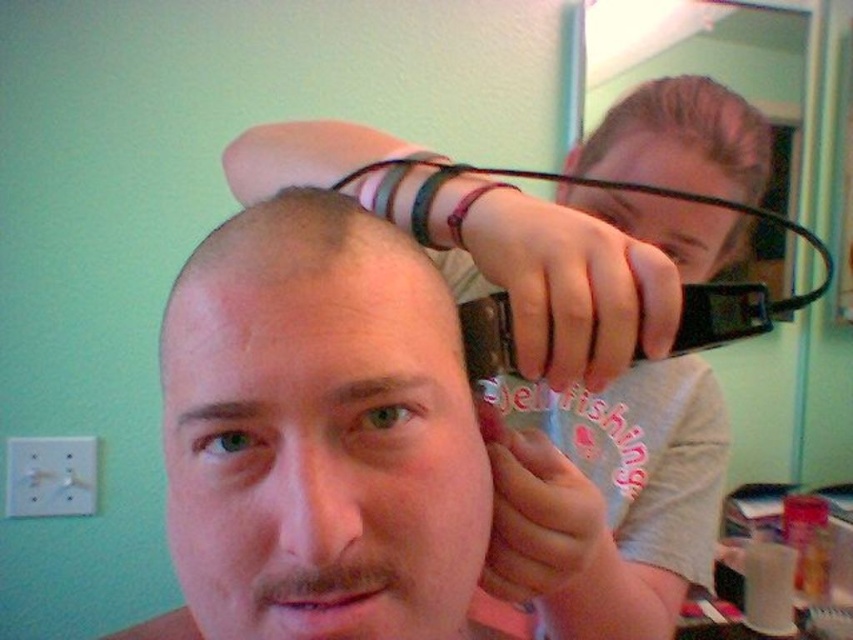
Question: Does matte black hair clipper at upper center have a greater width compared to slicked brown hair at upper center?

Choices:
 (A) no
 (B) yes

Answer: (B)

Question: Which point appears farthest from the camera in this image?

Choices:
 (A) (583, 499)
 (B) (387, 540)
 (C) (622, 100)

Answer: (C)

Question: Does smooth skin head at center have a smaller size compared to matte black hair clipper at upper center?

Choices:
 (A) no
 (B) yes

Answer: (B)

Question: Which of the following is the farthest from the observer?

Choices:
 (A) matte black hair clipper at upper center
 (B) slicked brown hair at upper center

Answer: (B)

Question: Does smooth skin head at center appear under matte black hair clipper at upper center?

Choices:
 (A) yes
 (B) no

Answer: (A)

Question: Which point is farther from the camera taking this photo?

Choices:
 (A) (223, 477)
 (B) (672, 157)
 (C) (579, 202)

Answer: (C)